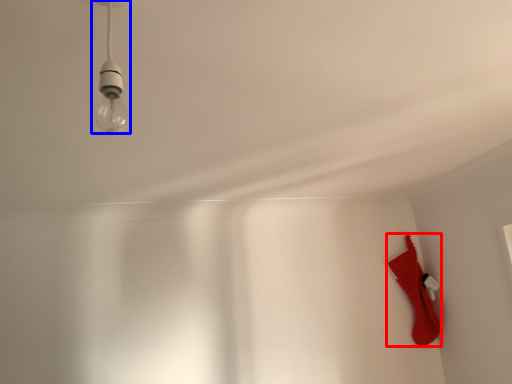
Question: Among these objects, which one is nearest to the camera, sock (highlighted by a red box) or lamp (highlighted by a blue box)?

Choices:
 (A) sock
 (B) lamp

Answer: (B)